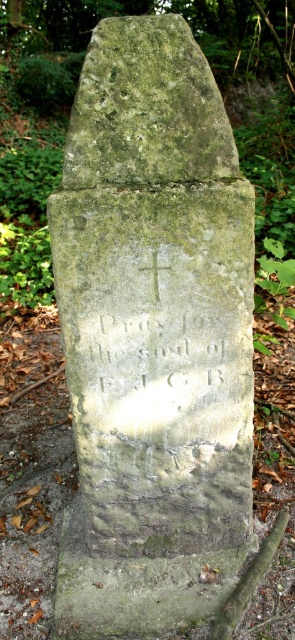
Question: Which point is farther to the camera?

Choices:
 (A) (236, 513)
 (B) (138, 269)
 (C) (140, 368)

Answer: (A)

Question: Which object is farther from the camera taking this photo?

Choices:
 (A) carved stone inscription at center
 (B) green stone gravestone at center
 (C) white stone cross at center

Answer: (A)

Question: Which of the following is the farthest from the observer?

Choices:
 (A) white stone cross at center
 (B) green stone gravestone at center

Answer: (A)

Question: Is green stone gravestone at center below carved stone inscription at center?

Choices:
 (A) yes
 (B) no

Answer: (B)

Question: Does green stone gravestone at center come in front of white stone cross at center?

Choices:
 (A) no
 (B) yes

Answer: (B)

Question: Is the position of carved stone inscription at center less distant than that of white stone cross at center?

Choices:
 (A) no
 (B) yes

Answer: (A)